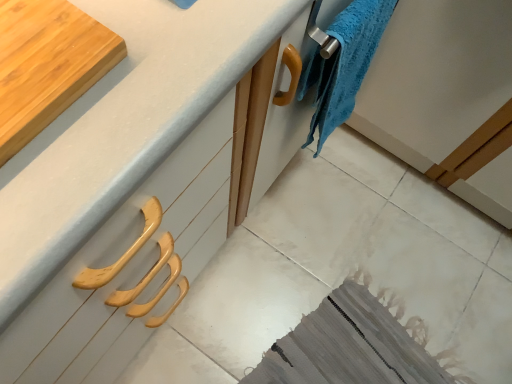
Question: Considering the relative sizes of wooden cutting board at upper left and white matte countertop at upper left in the image provided, is wooden cutting board at upper left bigger than white matte countertop at upper left?

Choices:
 (A) yes
 (B) no

Answer: (B)

Question: Considering the relative sizes of wooden cutting board at upper left and white matte countertop at upper left in the image provided, is wooden cutting board at upper left thinner than white matte countertop at upper left?

Choices:
 (A) no
 (B) yes

Answer: (B)

Question: Is wooden cutting board at upper left in contact with white matte countertop at upper left?

Choices:
 (A) no
 (B) yes

Answer: (A)

Question: Is wooden cutting board at upper left in front of white matte countertop at upper left?

Choices:
 (A) no
 (B) yes

Answer: (A)

Question: Is wooden cutting board at upper left outside white matte countertop at upper left?

Choices:
 (A) no
 (B) yes

Answer: (A)

Question: Can you confirm if wooden cutting board at upper left is positioned to the right of white matte countertop at upper left?

Choices:
 (A) yes
 (B) no

Answer: (B)

Question: Is wooden cutting board at upper left facing towards blue fuzzy towel at upper right?

Choices:
 (A) yes
 (B) no

Answer: (B)

Question: Is the depth of wooden cutting board at upper left less than that of blue fuzzy towel at upper right?

Choices:
 (A) no
 (B) yes

Answer: (B)

Question: Can you confirm if wooden cutting board at upper left is smaller than blue fuzzy towel at upper right?

Choices:
 (A) yes
 (B) no

Answer: (A)

Question: Is blue fuzzy towel at upper right a part of wooden cutting board at upper left?

Choices:
 (A) yes
 (B) no

Answer: (B)

Question: Does wooden cutting board at upper left appear on the right side of blue fuzzy towel at upper right?

Choices:
 (A) yes
 (B) no

Answer: (B)

Question: Is wooden cutting board at upper left far from blue fuzzy towel at upper right?

Choices:
 (A) no
 (B) yes

Answer: (A)

Question: From a real-world perspective, is blue fuzzy towel at upper right beneath wooden cutting board at upper left?

Choices:
 (A) yes
 (B) no

Answer: (A)